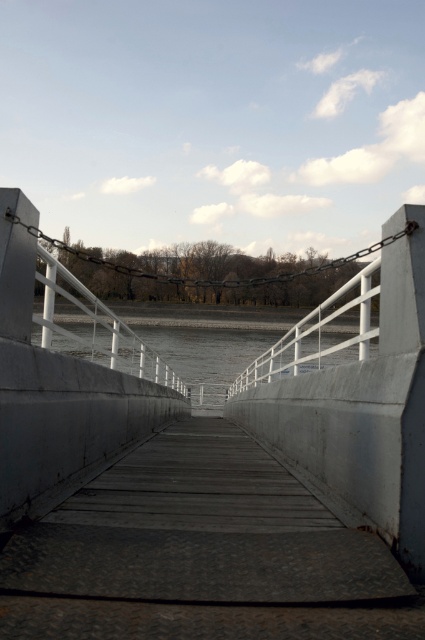
Question: Which of the following is the closest to the observer?

Choices:
 (A) gray concrete river at center
 (B) smooth concrete bridge at center

Answer: (B)

Question: Which point is closer to the camera?

Choices:
 (A) (421, 353)
 (B) (110, 328)

Answer: (A)

Question: Is smooth concrete bridge at center smaller than gray concrete river at center?

Choices:
 (A) no
 (B) yes

Answer: (B)

Question: Which point is farther to the camera?

Choices:
 (A) (0, 493)
 (B) (289, 337)

Answer: (B)

Question: Where is smooth concrete bridge at center located in relation to gray concrete river at center in the image?

Choices:
 (A) right
 (B) left

Answer: (B)

Question: Does smooth concrete bridge at center appear over gray concrete river at center?

Choices:
 (A) no
 (B) yes

Answer: (B)